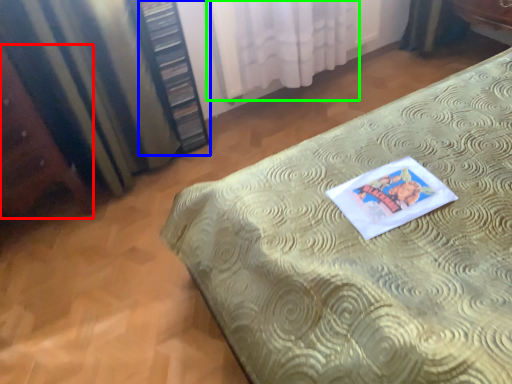
Question: Estimate the real-world distances between objects in this image. Which object is closer to vanity (highlighted by a red box), bookshelf (highlighted by a blue box) or curtain (highlighted by a green box)?

Choices:
 (A) bookshelf
 (B) curtain

Answer: (A)